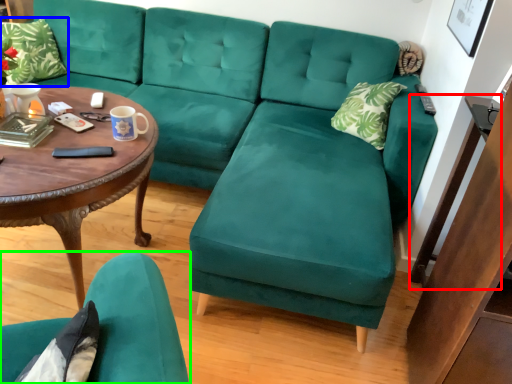
Question: Which object is the farthest from side table (highlighted by a red box)? Choose among these: pillow (highlighted by a blue box) or chair (highlighted by a green box).

Choices:
 (A) pillow
 (B) chair

Answer: (A)